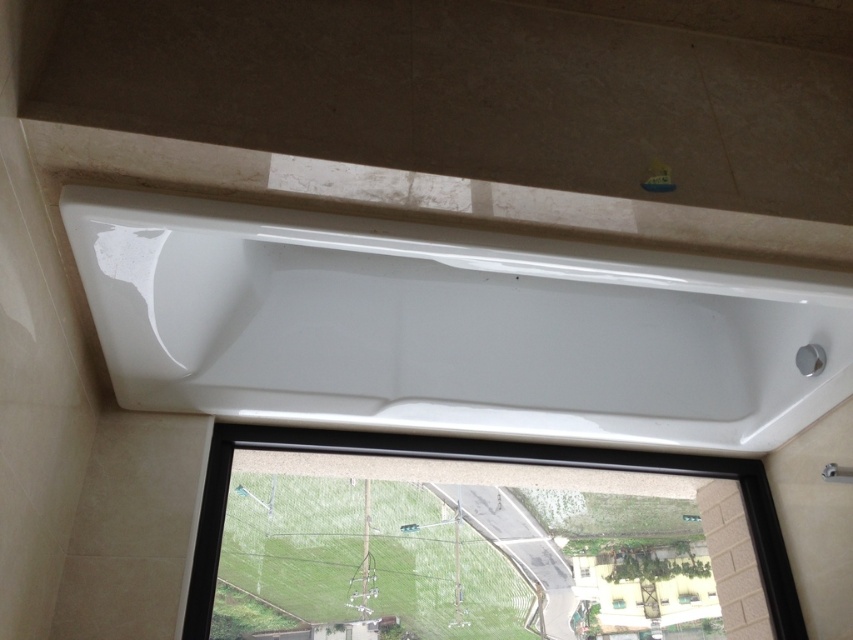
Which is in front, point (636, 324) or point (619, 600)?

Point (636, 324)

At what (x,y) coordinates should I click in order to perform the action: click on white glossy bathtub at center. Please return your answer as a coordinate pair (x, y). Image resolution: width=853 pixels, height=640 pixels. Looking at the image, I should click on (450, 326).

Does white glossy bathtub at center have a greater height compared to transparent glass window at lower center?

Correct, white glossy bathtub at center is much taller as transparent glass window at lower center.

Who is shorter, white glossy bathtub at center or transparent glass window at lower center?

transparent glass window at lower center is shorter.

Image resolution: width=853 pixels, height=640 pixels. I want to click on white glossy bathtub at center, so click(x=450, y=326).

Who is positioned more to the left, transparent glass window at lower center or transparent glass window at center?

transparent glass window at lower center

Can you confirm if transparent glass window at lower center is taller than transparent glass window at center?

Indeed, transparent glass window at lower center has a greater height compared to transparent glass window at center.

Which is behind, point (648, 452) or point (619, 604)?

Point (619, 604)

Find the location of a particular element. transparent glass window at lower center is located at coordinates (482, 460).